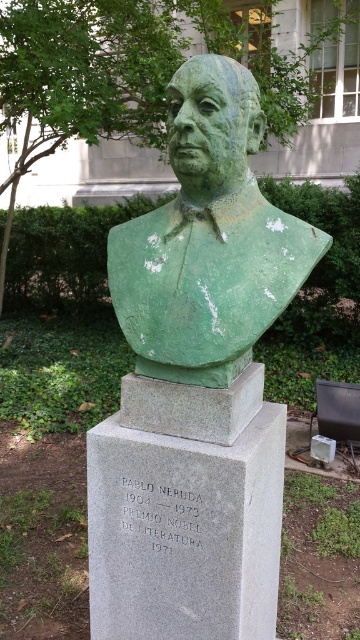
Question: In this image, where is green matte bust at center located relative to green patina bust at center?

Choices:
 (A) above
 (B) below

Answer: (B)

Question: Which of the following is the farthest from the observer?

Choices:
 (A) (189, 266)
 (B) (183, 81)

Answer: (A)

Question: Is green matte bust at center below green patina bust at center?

Choices:
 (A) no
 (B) yes

Answer: (B)

Question: Which point appears closest to the camera in this image?

Choices:
 (A) (151, 236)
 (B) (230, 125)

Answer: (B)

Question: Which point is farther from the camera taking this photo?

Choices:
 (A) (240, 304)
 (B) (173, 83)

Answer: (B)

Question: Where is green matte bust at center located in relation to green patina bust at center in the image?

Choices:
 (A) left
 (B) right

Answer: (B)